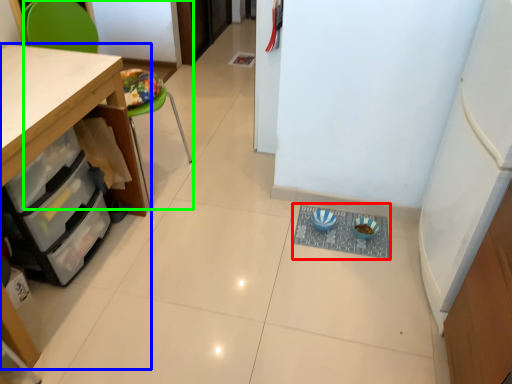
Question: Which object is the closest to the wide (highlighted by a red box)? Choose among these: cabinetry (highlighted by a blue box) or chair (highlighted by a green box).

Choices:
 (A) cabinetry
 (B) chair

Answer: (A)